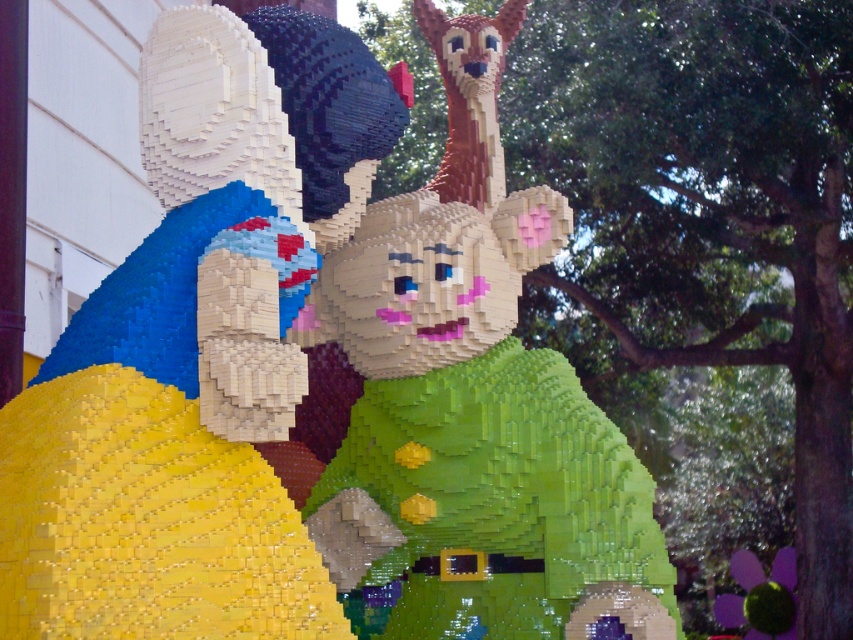
Is yellow matte brick at left shorter than green matte/soft toy at center?

Yes.

Measure the distance between point (321, 20) and camera.

The distance of point (321, 20) from camera is 182.43 feet.

This screenshot has height=640, width=853. Identify the location of yellow matte brick at left. (193, 352).